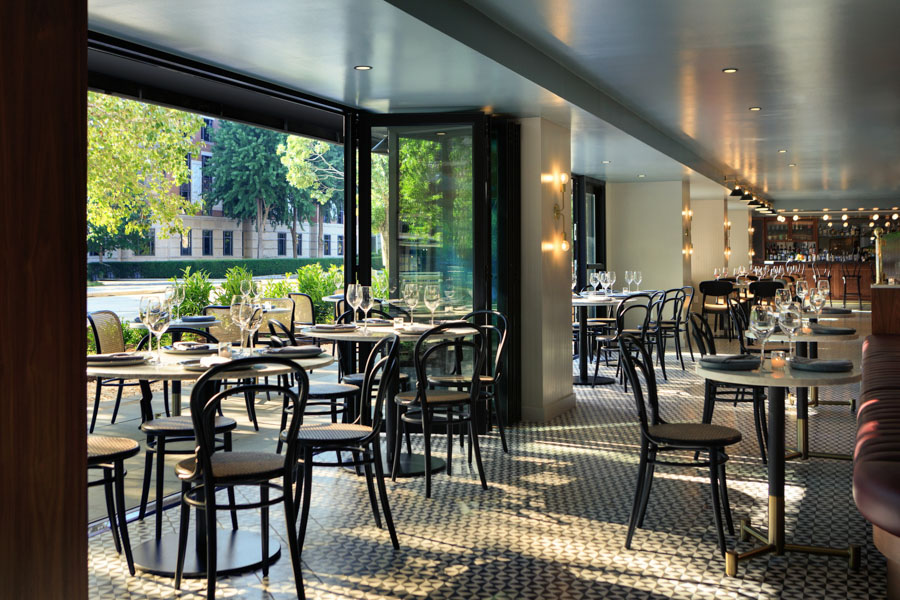
Identify the location of table stand. (777, 471), (801, 413).